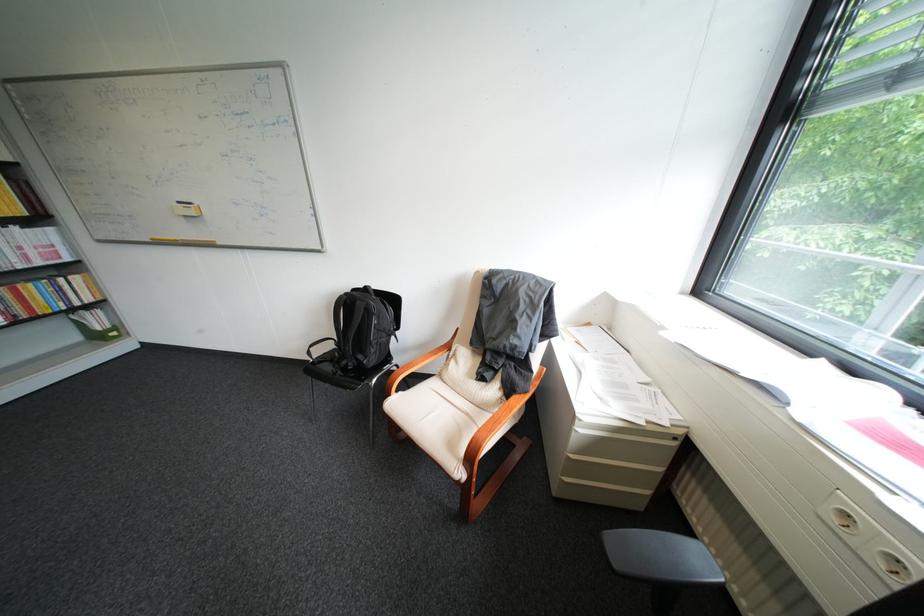
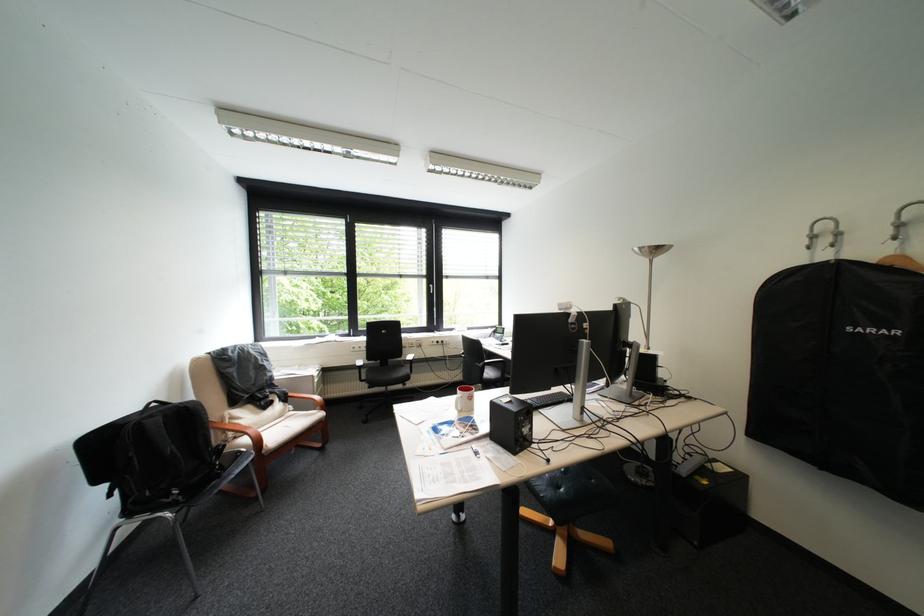
Locate, in the second image, the point that corresponds to [517,346] in the first image.

(280, 381)